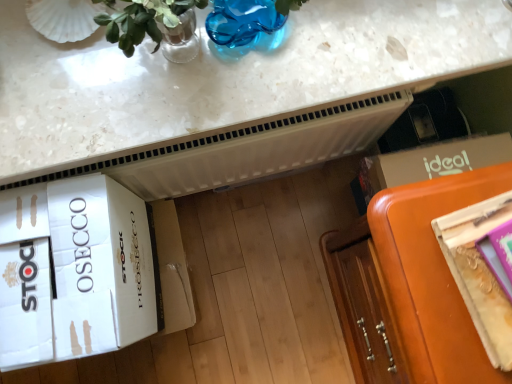
The image size is (512, 384). Describe the element at coordinates (224, 78) in the screenshot. I see `white marble countertop at upper center` at that location.

This screenshot has width=512, height=384. Describe the element at coordinates (479, 273) in the screenshot. I see `metallic gold magazine at right` at that location.

This screenshot has height=384, width=512. I want to click on white marble countertop at upper center, so click(x=224, y=78).

Is white cardboard box at lower left bigger or smaller than orange leather couch at lower right?

Clearly, white cardboard box at lower left is smaller in size than orange leather couch at lower right.

Could you tell me if white cardboard box at lower left is facing orange leather couch at lower right?

No, white cardboard box at lower left is not aimed at orange leather couch at lower right.

This screenshot has height=384, width=512. Find the location of `furniture below the white cardboard box at lower left (from the image's perspective)`. furniture below the white cardboard box at lower left (from the image's perspective) is located at coordinates (x=410, y=284).

Considering the relative sizes of white cardboard box at lower left and orange leather couch at lower right in the image provided, is white cardboard box at lower left taller than orange leather couch at lower right?

Incorrect, the height of white cardboard box at lower left is not larger of that of orange leather couch at lower right.

Considering the sizes of orange leather couch at lower right and blue glass vase at upper center in the image, is orange leather couch at lower right bigger or smaller than blue glass vase at upper center?

Clearly, orange leather couch at lower right is larger in size than blue glass vase at upper center.

Is orange leather couch at lower right not near blue glass vase at upper center?

They are positioned close to each other.

Between orange leather couch at lower right and blue glass vase at upper center, which one has larger width?

Wider between the two is orange leather couch at lower right.

Does metallic gold magazine at right have a greater height compared to white cardboard box at lower left?

Incorrect, the height of metallic gold magazine at right is not larger of that of white cardboard box at lower left.

Is metallic gold magazine at right positioned far away from white cardboard box at lower left?

No.

Can you tell me how much blue glass vase at upper center and white marble countertop at upper center differ in facing direction?

They differ by 0.16 degrees in their facing directions.

Considering the sizes of objects blue glass vase at upper center and white marble countertop at upper center in the image provided, who is smaller, blue glass vase at upper center or white marble countertop at upper center?

blue glass vase at upper center.

Considering the relative sizes of blue glass vase at upper center and white marble countertop at upper center in the image provided, is blue glass vase at upper center shorter than white marble countertop at upper center?

Incorrect, the height of blue glass vase at upper center does not fall short of that of white marble countertop at upper center.

Is point (225, 11) closer to viewer compared to point (324, 52)?

Yes, it is in front of point (324, 52).

Which is more to the left, white marble countertop at upper center or blue glass vase at upper center?

Answer: Positioned to the left is blue glass vase at upper center.

Is white marble countertop at upper center facing towards blue glass vase at upper center?

Yes, white marble countertop at upper center is aimed at blue glass vase at upper center.

In the image, is white marble countertop at upper center positioned in front of or behind blue glass vase at upper center?

Clearly, white marble countertop at upper center is behind blue glass vase at upper center.

The width and height of the screenshot is (512, 384). I want to click on countertop that appears behind the blue glass vase at upper center, so click(224, 78).

Between point (218, 8) and point (184, 284), which one is positioned behind?

The point (184, 284) is farther.

From the picture: In terms of size, does blue glass vase at upper center appear bigger or smaller than white cardboard box at lower left?

Considering their sizes, blue glass vase at upper center takes up less space than white cardboard box at lower left.

Considering the sizes of objects blue glass vase at upper center and white cardboard box at lower left in the image provided, who is wider, blue glass vase at upper center or white cardboard box at lower left?

white cardboard box at lower left.

Can you confirm if white marble countertop at upper center is shorter than white cardboard box at lower left?

Correct, white marble countertop at upper center is not as tall as white cardboard box at lower left.

Considering the relative sizes of white marble countertop at upper center and white cardboard box at lower left in the image provided, is white marble countertop at upper center thinner than white cardboard box at lower left?

No.

Considering the sizes of white marble countertop at upper center and white cardboard box at lower left in the image, is white marble countertop at upper center bigger or smaller than white cardboard box at lower left?

white marble countertop at upper center is bigger than white cardboard box at lower left.

Image resolution: width=512 pixels, height=384 pixels. Find the location of `cardboard box on the left of orange leather couch at lower right`. cardboard box on the left of orange leather couch at lower right is located at coordinates (84, 272).

Locate an element on the screen. This screenshot has height=384, width=512. furniture below the blue glass vase at upper center (from the image's perspective) is located at coordinates (410, 284).

Based on the photo, estimate the real-world distances between objects in this image. Which object is closer to white cardboard box at lower left, blue glass vase at upper center or metallic gold magazine at right?

Based on the image, blue glass vase at upper center appears to be nearer to white cardboard box at lower left.

Looking at the image, which one is located further to white marble countertop at upper center, orange leather couch at lower right or blue glass vase at upper center?

orange leather couch at lower right is further to white marble countertop at upper center.

From the image, which object appears to be farther from white marble countertop at upper center, orange leather couch at lower right or metallic gold magazine at right?

Based on the image, metallic gold magazine at right appears to be further to white marble countertop at upper center.

Considering their positions, is metallic gold magazine at right positioned further to white cardboard box at lower left than white marble countertop at upper center?

metallic gold magazine at right is positioned further to the anchor white cardboard box at lower left.

Considering their positions, is blue glass vase at upper center positioned further to white cardboard box at lower left than white marble countertop at upper center?

The object further to white cardboard box at lower left is blue glass vase at upper center.

Looking at the image, which one is located closer to blue glass vase at upper center, white cardboard box at lower left or metallic gold magazine at right?

white cardboard box at lower left is closer to blue glass vase at upper center.

Estimate the real-world distances between objects in this image. Which object is closer to metallic gold magazine at right, white cardboard box at lower left or white marble countertop at upper center?

white marble countertop at upper center.

Estimate the real-world distances between objects in this image. Which object is closer to metallic gold magazine at right, orange leather couch at lower right or white marble countertop at upper center?

orange leather couch at lower right lies closer to metallic gold magazine at right than the other object.

This screenshot has width=512, height=384. What are the coordinates of `countertop that lies between blue glass vase at upper center and white cardboard box at lower left from top to bottom` in the screenshot? It's located at (224, 78).

Where is `countertop located between blue glass vase at upper center and metallic gold magazine at right in the left-right direction`? Image resolution: width=512 pixels, height=384 pixels. countertop located between blue glass vase at upper center and metallic gold magazine at right in the left-right direction is located at coordinates (224, 78).

I want to click on countertop situated between white cardboard box at lower left and metallic gold magazine at right from left to right, so click(x=224, y=78).

You are a GUI agent. You are given a task and a screenshot of the screen. Output one action in this format:
    pyautogui.click(x=<x>, y=<y>)
    Task: Click on the countertop that lies between blue glass vase at upper center and orange leather couch at lower right from top to bottom
    
    Given the screenshot: What is the action you would take?
    pyautogui.click(x=224, y=78)